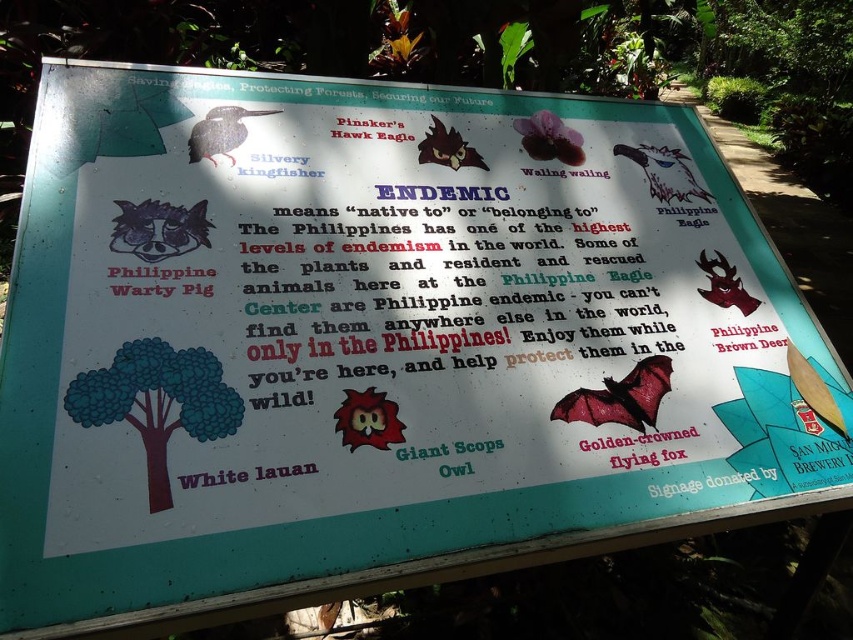
You are standing in front of the signboard and notice two points marked on the image. The first point is at coordinates point (216, 371) and the second is at point (640, 419). Which point is closer to you?

Point (216, 371) is in front of point 0.651, 0.751, so the first point is closer to you.

You are a wildlife researcher observing the signboard. You need to compare the sizes of the shiny red bat at center and the matte brown deer at upper right. Which one has a larger width?

The shiny red bat at center has a larger width than the matte brown deer at upper right according to the description provided.